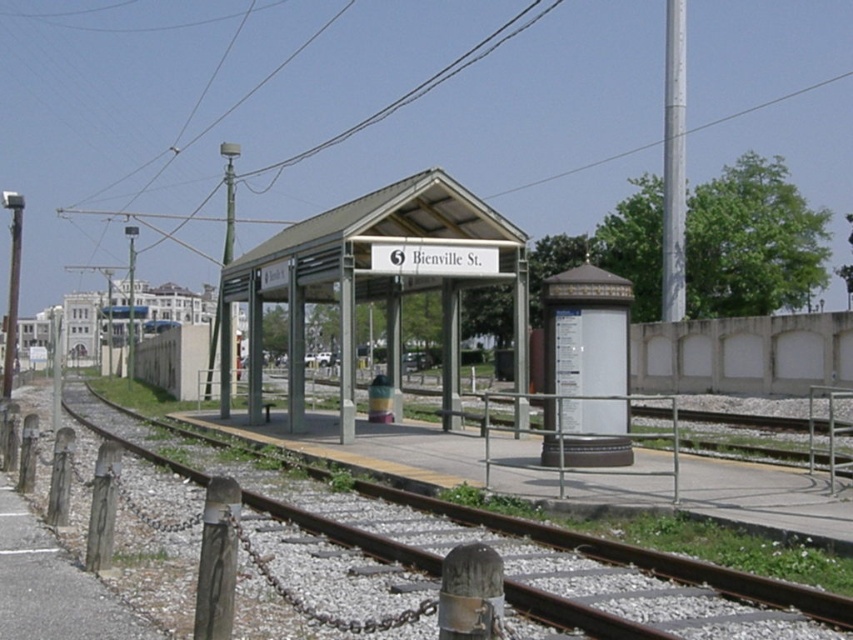
You are a delivery person trying to park your 2.5 meter wide delivery van. You see the metallic gray bus stop at center and the rusty metal train track at lower left. Which location has enough space to park your van without overlapping?

The rusty metal train track at lower left has a width greater than the metallic gray bus stop at center. Since the van is 2.5 meters wide, the rusty metal train track at lower left can accommodate the van, while the metallic gray bus stop at center is too narrow.

You are a pedestrian standing on the platform at Bienville Street station. You need to find the metallic gray bus stop at center and the white painted metal pole at upper right. According to the scene, which object is located to the left of the other?

The metallic gray bus stop at center is positioned on the left side of white painted metal pole at upper right, so the bus stop is to the left of the pole.

You are standing at the Bienville Street train station platform and need to find the metallic gray bus stop at center. Based on your current position, which direction should you walk to reach it?

The metallic gray bus stop at center is located at point (376, 278), so you should walk towards the center of the platform to reach it.